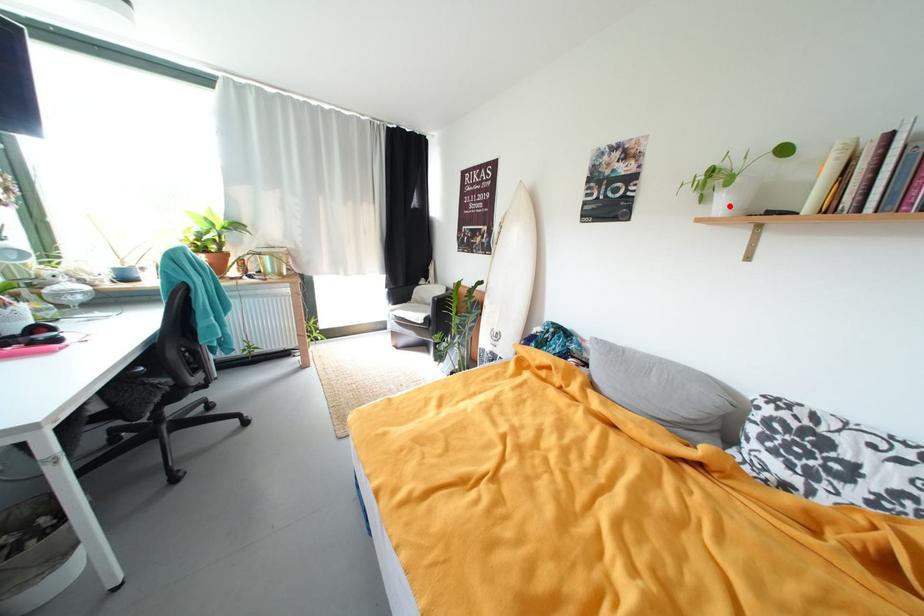
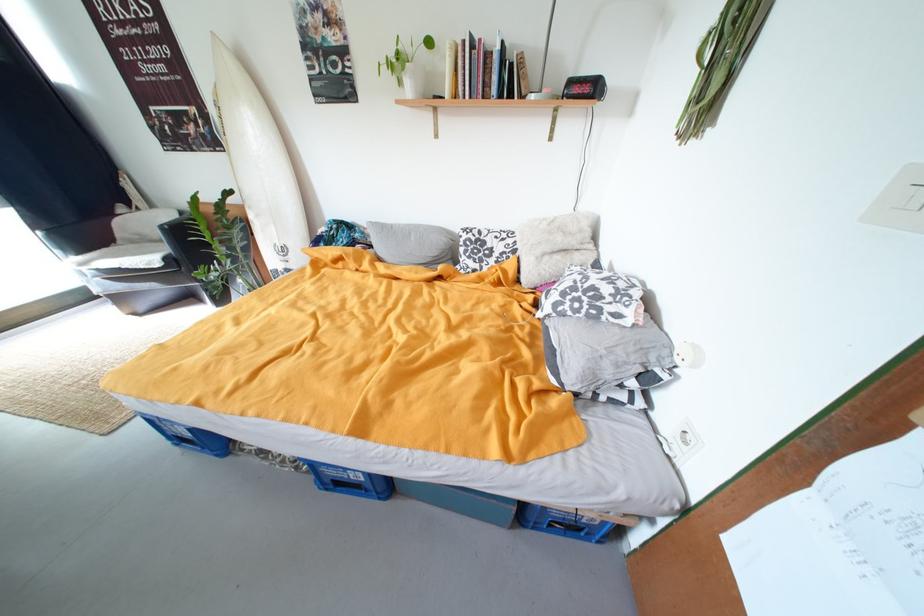
The point at the highlighted location is marked in the first image. Where is the corresponding point in the second image?

(418, 90)